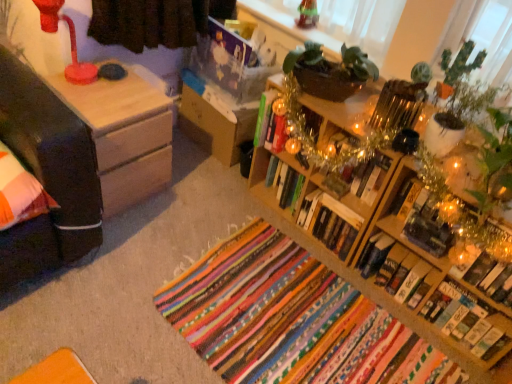
Find the location of a particular element. Image resolution: width=512 pixels, height=384 pixels. free location in front of hardcover book at center-right, positioned as the 5th book in right-to-left order is located at coordinates (387, 320).